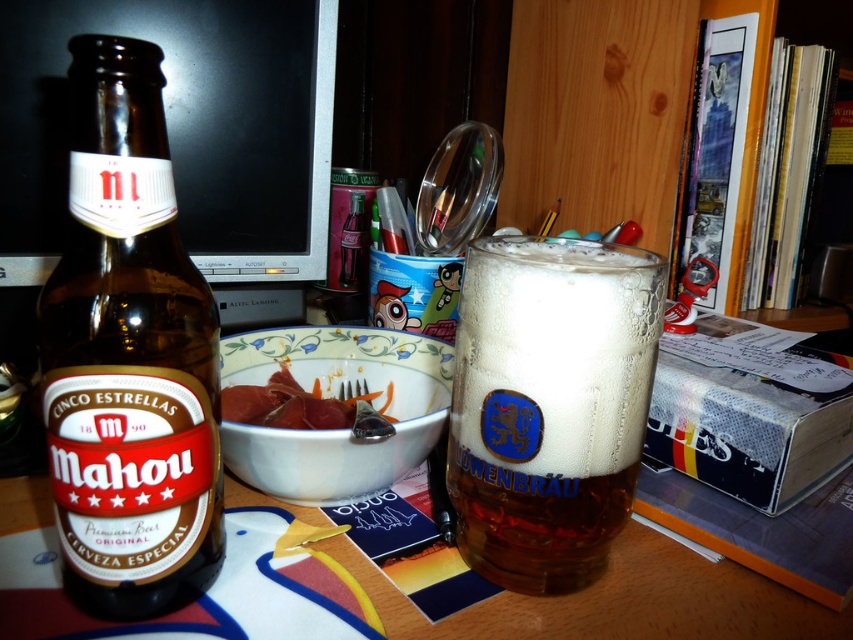
Question: Is white ceramic bowl at center bigger than smooth pinkish meat at center?

Choices:
 (A) yes
 (B) no

Answer: (A)

Question: Considering the real-world distances, which object is closest to the clear glass bottle at center?

Choices:
 (A) brown glass bottle at left
 (B) black glossy computer monitor at upper center
 (C) translucent glass mug at center
 (D) metallic reflective magnifying glass at upper center

Answer: (D)

Question: Does black glossy computer monitor at upper center have a greater width compared to clear glass bottle at center?

Choices:
 (A) yes
 (B) no

Answer: (A)

Question: Observing the image, what is the correct spatial positioning of brown glass bottle at left in reference to smooth pinkish meat at center?

Choices:
 (A) right
 (B) left

Answer: (B)

Question: Which point is closer to the camera?

Choices:
 (A) black glossy computer monitor at upper center
 (B) white ceramic bowl at center
 (C) metallic reflective magnifying glass at upper center

Answer: (B)

Question: Which point appears farthest from the camera in this image?

Choices:
 (A) (55, 448)
 (B) (352, 269)

Answer: (B)